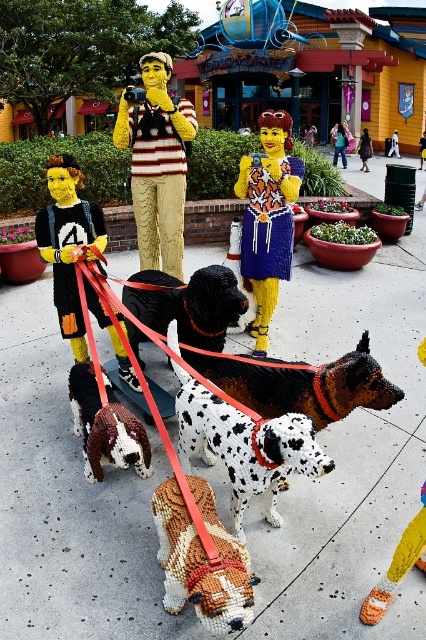
Question: Which point is farther from the camera taking this photo?

Choices:
 (A) (262, 291)
 (B) (175, 305)
 (C) (276, 467)
 (D) (311, 416)

Answer: (A)

Question: Observing the image, what is the correct spatial positioning of yellow painted figure at center in reference to matte black dog at left?

Choices:
 (A) below
 (B) above

Answer: (B)

Question: Is matte black dog at left smaller than brown and white speckled dog at center?

Choices:
 (A) yes
 (B) no

Answer: (B)

Question: Does brown speckled fabric dog at center come behind smooth yellow hair at center?

Choices:
 (A) no
 (B) yes

Answer: (A)

Question: Which point is closer to the camera?

Choices:
 (A) matte black dog at left
 (B) brown speckled fabric dog at center
 (C) white speckled plastic dog at center
 (D) black glossy dog at center

Answer: (B)

Question: Which object appears closest to the camera in this image?

Choices:
 (A) black glossy dog at center
 (B) white speckled plastic dog at center
 (C) brown and white speckled dog at center

Answer: (B)